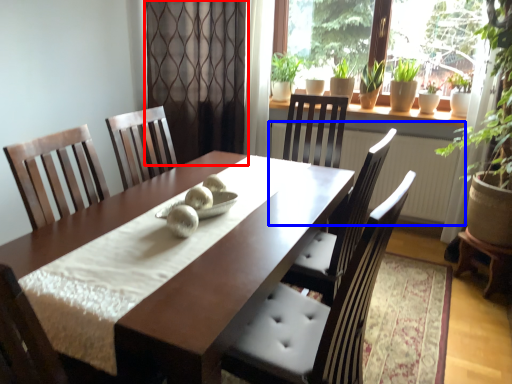
Question: Which of the following is the farthest to the observer, screen door (highlighted by a red box) or radiator (highlighted by a blue box)?

Choices:
 (A) screen door
 (B) radiator

Answer: (A)